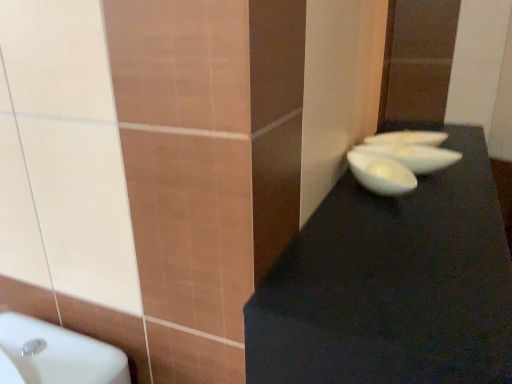
The image size is (512, 384). Identify the location of free space above white glossy bowl at center right (from a real-world perspective). (371, 154).